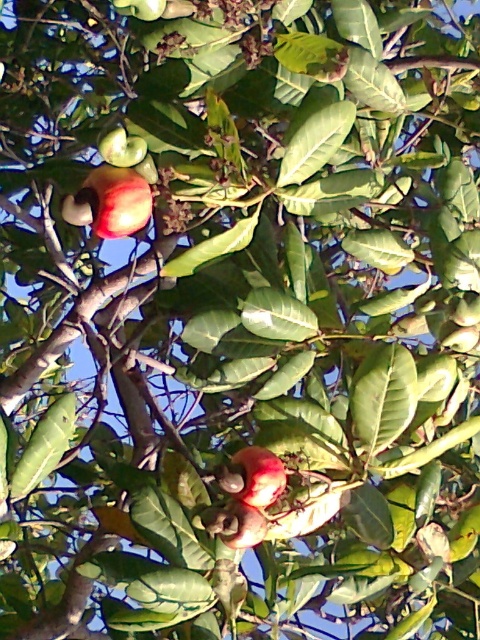
Does shiny red apple at upper left appear on the right side of shiny red apple at upper center?

Incorrect, shiny red apple at upper left is not on the right side of shiny red apple at upper center.

Does shiny red apple at upper left have a greater width compared to shiny red apple at upper center?

Indeed, shiny red apple at upper left has a greater width compared to shiny red apple at upper center.

Which is behind, point (94, 193) or point (154, 19)?

Positioned behind is point (94, 193).

Find the location of `shiny red apple at upper left`. shiny red apple at upper left is located at coordinates (110, 202).

Is point (218, 481) positioned after point (147, 13)?

Yes.

Is point (272, 493) closer to camera compared to point (146, 19)?

That is False.

The image size is (480, 640). Describe the element at coordinates (253, 476) in the screenshot. I see `shiny red apple at center` at that location.

This screenshot has height=640, width=480. I want to click on shiny red apple at center, so click(x=253, y=476).

Who is more forward, (x=107, y=202) or (x=255, y=500)?

Point (x=107, y=202) is more forward.

Does shiny red apple at upper left appear on the right side of shiny red apple at center?

No, shiny red apple at upper left is not to the right of shiny red apple at center.

Image resolution: width=480 pixels, height=640 pixels. In order to click on shiny red apple at upper left in this screenshot , I will do `click(110, 202)`.

Locate an element on the screen. The height and width of the screenshot is (640, 480). shiny red apple at upper left is located at coordinates (110, 202).